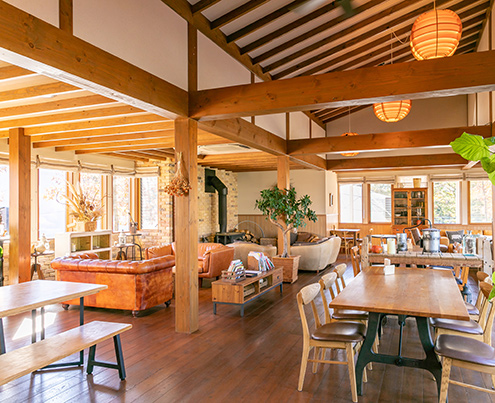
Find the location of a particular element. The height and width of the screenshot is (403, 495). back windows is located at coordinates (360, 200), (372, 203), (440, 204), (479, 203).